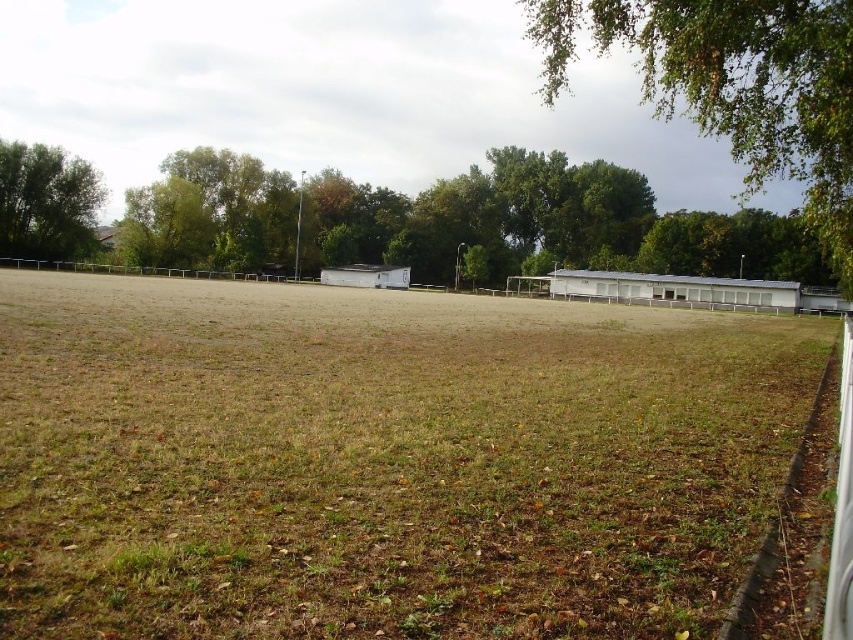
Can you confirm if brown grass at center is wider than green leafy tree at left?

Correct, the width of brown grass at center exceeds that of green leafy tree at left.

Is brown grass at center thinner than green leafy tree at left?

Incorrect, brown grass at center's width is not less than green leafy tree at left's.

Describe the element at coordinates (381, 460) in the screenshot. Image resolution: width=853 pixels, height=640 pixels. I see `brown grass at center` at that location.

At what (x,y) coordinates should I click in order to perform the action: click on brown grass at center. Please return your answer as a coordinate pair (x, y). This screenshot has height=640, width=853. Looking at the image, I should click on (381, 460).

Looking at this image, can you confirm if green leafy tree at upper right is positioned above green leafy tree at left?

Correct, green leafy tree at upper right is located above green leafy tree at left.

Locate an element on the screen. The image size is (853, 640). green leafy tree at upper right is located at coordinates (735, 84).

Does point (793, 113) come farther from viewer compared to point (91, 220)?

No, (793, 113) is in front of (91, 220).

Where is `green leafy tree at upper right`? green leafy tree at upper right is located at coordinates (735, 84).

What do you see at coordinates (381, 460) in the screenshot?
I see `brown grass at center` at bounding box center [381, 460].

Can you confirm if brown grass at center is shorter than green leafy tree at upper right?

Yes.

Who is more forward, (618, 435) or (700, 35)?

Positioned in front is point (618, 435).

Image resolution: width=853 pixels, height=640 pixels. In order to click on brown grass at center in this screenshot , I will do `click(381, 460)`.